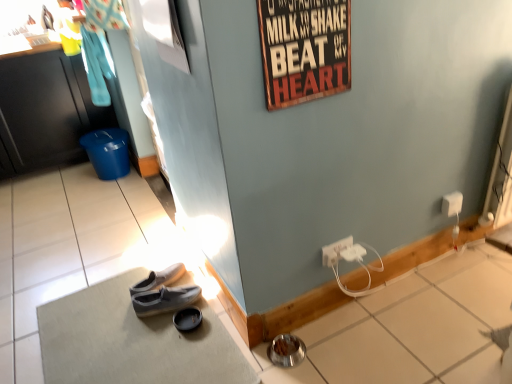
This screenshot has width=512, height=384. Describe the element at coordinates (108, 152) in the screenshot. I see `blue plastic trash can at left` at that location.

Locate an element on the screen. white plastic power outlet at lower right, marked as the 3th power outlet in a right-to-left arrangement is located at coordinates (335, 251).

Describe the element at coordinates (163, 293) in the screenshot. The height and width of the screenshot is (384, 512). I see `gray suede shoes at lower center, arranged as the 2th footwear when viewed from the right` at that location.

Measure the distance between white plastic power outlet at lower right, the first power outlet in the right-to-left sequence, and camera.

They are 6.30 feet apart.

What do you see at coordinates (304, 49) in the screenshot? I see `wooden signboard at upper center` at bounding box center [304, 49].

Consider the image. In order to face wooden signboard at upper center, should I rotate leftwards or rightwards?

You should look right and rotate roughly 6.800 degrees.

Where is `blue plastic trash can at left`? This screenshot has width=512, height=384. blue plastic trash can at left is located at coordinates (108, 152).

Which is farther, (x=68, y=146) or (x=336, y=2)?

The point (x=68, y=146) is behind.

Considering their positions, is black matte cabinet at left located in front of or behind wooden signboard at upper center?

black matte cabinet at left is behind wooden signboard at upper center.

Is there a large distance between black matte cabinet at left and wooden signboard at upper center?

Absolutely, black matte cabinet at left is distant from wooden signboard at upper center.

Consider the image. Considering the sizes of objects black matte cabinet at left and wooden signboard at upper center in the image provided, who is smaller, black matte cabinet at left or wooden signboard at upper center?

wooden signboard at upper center.

Considering the points (31, 126) and (455, 209), which point is in front, point (31, 126) or point (455, 209)?

Positioned in front is point (455, 209).

Considering the relative sizes of black matte cabinet at left and white plastic power outlet at lower right, the first power outlet in the right-to-left sequence, in the image provided, is black matte cabinet at left thinner than white plastic power outlet at lower right, the first power outlet in the right-to-left sequence,?

In fact, black matte cabinet at left might be wider than white plastic power outlet at lower right, the first power outlet in the right-to-left sequence.

Would you say white plastic power outlet at lower right, the 3th power outlet when ordered from bottom to top, is part of black matte cabinet at left's contents?

No, white plastic power outlet at lower right, the 3th power outlet when ordered from bottom to top, is located outside of black matte cabinet at left.

Could you tell me if black matte cabinet at left is turned towards white plastic power outlet at lower right, which appears as the third power outlet when viewed from the front?

No, black matte cabinet at left is not oriented towards white plastic power outlet at lower right, which appears as the third power outlet when viewed from the front.

Can you see white plastic power outlet at lower right, the first power outlet positioned from the left, touching white glossy tile at lower right?

There is a gap between white plastic power outlet at lower right, the first power outlet positioned from the left, and white glossy tile at lower right.

Does white plastic power outlet at lower right, marked as the 3th power outlet in a right-to-left arrangement, have a larger size compared to white glossy tile at lower right?

Actually, white plastic power outlet at lower right, marked as the 3th power outlet in a right-to-left arrangement, might be smaller than white glossy tile at lower right.

Is white plastic power outlet at lower right, positioned as the second power outlet in back-to-front order, turned away from white glossy tile at lower right?

white plastic power outlet at lower right, positioned as the second power outlet in back-to-front order, does not have its back to white glossy tile at lower right.

How many degrees apart are the facing directions of white plastic power outlet at lower right, positioned as the second power outlet in back-to-front order, and white glossy tile at lower right?

There is a 1.04-degree angle between the facing directions of white plastic power outlet at lower right, positioned as the second power outlet in back-to-front order, and white glossy tile at lower right.

Is blue plastic trash can at left far from white glossy tile at lower right?

Yes, blue plastic trash can at left and white glossy tile at lower right are quite far apart.

There is a white glossy tile at lower right. Where is `trash bin/can above it (from a real-world perspective)`? The height and width of the screenshot is (384, 512). trash bin/can above it (from a real-world perspective) is located at coordinates coord(108,152).

From the image's perspective, which one is positioned higher, blue plastic trash can at left or white glossy tile at lower right?

blue plastic trash can at left, from the image's perspective.

Is blue plastic trash can at left oriented towards white glossy tile at lower right?

No.

Between white glossy tile at lower right and white plastic power outlet at lower right, marked as the 3th power outlet in a right-to-left arrangement, which one has smaller width?

With smaller width is white plastic power outlet at lower right, marked as the 3th power outlet in a right-to-left arrangement.

Is point (265, 365) behind point (335, 259)?

No.

Which object is closer to the camera, white glossy tile at lower right or white plastic power outlet at lower right, marked as the 2th power outlet in a front-to-back arrangement?

white glossy tile at lower right.

Is white glossy tile at lower right smaller than white plastic power outlet at lower right, marked as the 2th power outlet in a front-to-back arrangement?

Actually, white glossy tile at lower right might be larger than white plastic power outlet at lower right, marked as the 2th power outlet in a front-to-back arrangement.

Locate an element on the screen. the 2nd footwear above when counting from the gray fabric doormat at lower left (from the image's perspective) is located at coordinates (163, 293).

From the image's perspective, which one is positioned lower, gray suede shoes at lower center, arranged as the 2th footwear when viewed from the right, or gray fabric doormat at lower left?

gray fabric doormat at lower left is shown below in the image.

Would you say gray suede shoes at lower center, which is the 1th footwear from left to right, is inside or outside gray fabric doormat at lower left?

gray suede shoes at lower center, which is the 1th footwear from left to right, is enclosed within gray fabric doormat at lower left.

Consider the image. Is blue plastic trash can at left looking in the opposite direction of white plastic power outlet at lower right, marked as the 3th power outlet in a left-to-right arrangement?

No, white plastic power outlet at lower right, marked as the 3th power outlet in a left-to-right arrangement, is not at the back of blue plastic trash can at left.

Does point (115, 150) appear closer or farther from the camera than point (445, 198)?

Point (115, 150) is positioned farther from the camera compared to point (445, 198).

Between blue plastic trash can at left and white plastic power outlet at lower right, marked as the 3th power outlet in a left-to-right arrangement, which one has smaller size?

With smaller size is white plastic power outlet at lower right, marked as the 3th power outlet in a left-to-right arrangement.

This screenshot has height=384, width=512. Find the location of `cabinetry behind the wooden signboard at upper center`. cabinetry behind the wooden signboard at upper center is located at coordinates pos(45,112).

Where is `the 3rd power outlet counting from the right of the black matte cabinet at left`? the 3rd power outlet counting from the right of the black matte cabinet at left is located at coordinates (452, 204).

When comparing their distances from matte gray shoe at center, which is counted as the 2th footwear, starting from the left, does white glossy tile at lower right or black matte cabinet at left seem further?

Among the two, black matte cabinet at left is located further to matte gray shoe at center, which is counted as the 2th footwear, starting from the left.

From the image, which object appears to be nearer to wooden signboard at upper center, matte gray shoe at center, which is counted as the 2th footwear, starting from the left, or gray fabric doormat at lower left?

gray fabric doormat at lower left.

Considering their positions, is wooden signboard at upper center positioned closer to white glossy tile at lower right than black matte cabinet at left?

Based on the image, wooden signboard at upper center appears to be nearer to white glossy tile at lower right.

From the image, which object appears to be nearer to wooden signboard at upper center, gray suede shoes at lower center, arranged as the 2th footwear when viewed from the right, or white plastic power outlet at lower right, marked as the 2th power outlet in a front-to-back arrangement?

Among the two, white plastic power outlet at lower right, marked as the 2th power outlet in a front-to-back arrangement, is located nearer to wooden signboard at upper center.

From the image, which object appears to be nearer to white plastic power outlet at lower right, the first power outlet in the right-to-left sequence, blue plastic trash can at left or black matte cabinet at left?

blue plastic trash can at left is closer to white plastic power outlet at lower right, the first power outlet in the right-to-left sequence.

Based on their spatial positions, is gray fabric doormat at lower left or black matte cabinet at left further from wooden signboard at upper center?

The object further to wooden signboard at upper center is black matte cabinet at left.

Looking at the image, which one is located closer to black matte cabinet at left, white glossy tile at lower right or gray fabric doormat at lower left?

The object closer to black matte cabinet at left is gray fabric doormat at lower left.

When comparing their distances from white plastic power outlet at lower right, positioned as the second power outlet in back-to-front order, does white plastic power outlet at lower right, placed as the first power outlet when sorted from top to bottom, or wooden signboard at upper center seem closer?

white plastic power outlet at lower right, placed as the first power outlet when sorted from top to bottom, is closer to white plastic power outlet at lower right, positioned as the second power outlet in back-to-front order.

Find the location of `doormat between blue plastic trash can at left and white glossy tile at lower right from left to right`. doormat between blue plastic trash can at left and white glossy tile at lower right from left to right is located at coordinates (133, 341).

Where is `power outlet located between matte gray shoe at center, the first footwear viewed from the right, and white plastic power outlet at lower right, the first power outlet ordered from the bottom, in the left-right direction`? Image resolution: width=512 pixels, height=384 pixels. power outlet located between matte gray shoe at center, the first footwear viewed from the right, and white plastic power outlet at lower right, the first power outlet ordered from the bottom, in the left-right direction is located at coordinates (335, 251).

The image size is (512, 384). Identify the location of trash bin/can between black matte cabinet at left and white plastic power outlet at lower right, positioned as the second power outlet in back-to-front order, from left to right. (108, 152).

At what (x,y) coordinates should I click in order to perform the action: click on tile between white plastic power outlet at lower right, which appears as the second power outlet when ordered from the bottom, and white plastic power outlet at lower right, placed as the first power outlet when sorted from top to bottom. Please return your answer as a coordinate pair (x, y). Looking at the image, I should click on (411, 328).